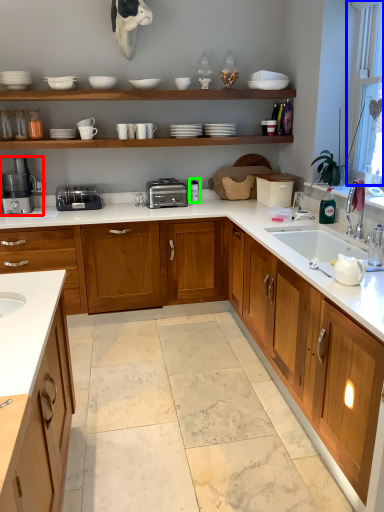
Question: Which object is the farthest from coffee machine (highlighted by a red box)? Choose among these: window screen (highlighted by a blue box) or appliance (highlighted by a green box).

Choices:
 (A) window screen
 (B) appliance

Answer: (A)